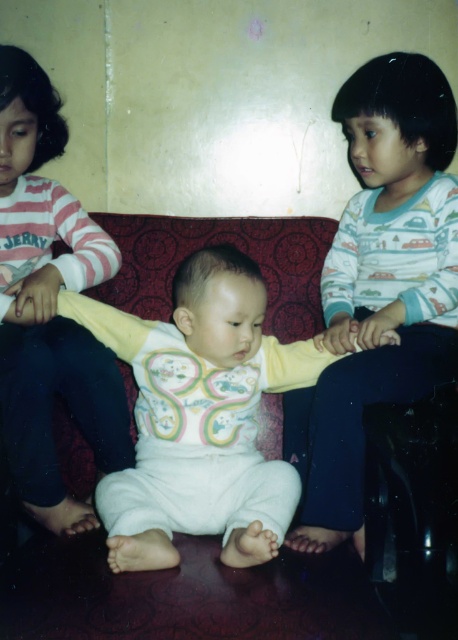
Locate an element on the screen. white cotton shirt at right is located at coordinates point(380,285).

Can you confirm if white cotton shirt at right is positioned above white soft baby at center?

No, white cotton shirt at right is not above white soft baby at center.

Which is in front, point (436, 186) or point (10, 385)?

Point (10, 385)

Image resolution: width=458 pixels, height=640 pixels. Identify the location of white cotton shirt at right. (380, 285).

Is point (263, 296) farther from camera compared to point (98, 442)?

That is False.

Who is positioned more to the left, white soft onesie at center or white soft baby at center?

Positioned to the left is white soft baby at center.

What are the coordinates of `white soft onesie at center` in the screenshot? It's located at (200, 400).

Between white cotton shirt at right and white soft onesie at center, which one has more height?

Standing taller between the two is white cotton shirt at right.

Is white cotton shirt at right to the left of white soft onesie at center from the viewer's perspective?

Incorrect, white cotton shirt at right is not on the left side of white soft onesie at center.

Which is behind, point (436, 305) or point (141, 465)?

Positioned behind is point (436, 305).

I want to click on white cotton shirt at right, so click(380, 285).